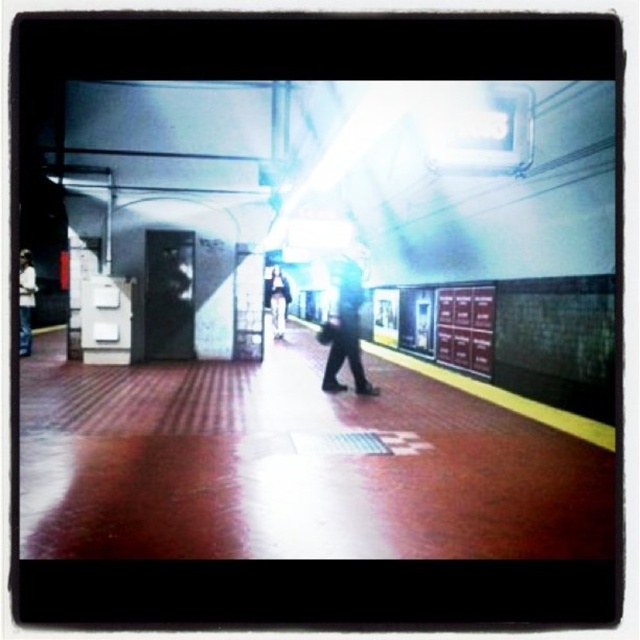
Does dark gray pants at center have a lesser width compared to light brown leather jacket at center?

Indeed, dark gray pants at center has a lesser width compared to light brown leather jacket at center.

Who is more forward, (x=348, y=308) or (x=285, y=291)?

Point (x=348, y=308) is in front.

Between point (352, 276) and point (276, 301), which one is positioned behind?

Positioned behind is point (276, 301).

In order to click on dark gray pants at center in this screenshot , I will do `click(346, 333)`.

What do you see at coordinates (320, 321) in the screenshot? Image resolution: width=640 pixels, height=640 pixels. I see `shiny metallic platform at center` at bounding box center [320, 321].

Which is behind, point (152, 227) or point (275, 330)?

Positioned behind is point (275, 330).

Image resolution: width=640 pixels, height=640 pixels. In order to click on shiny metallic platform at center in this screenshot , I will do `click(320, 321)`.

Between shiny metallic platform at center and matte black jacket at left, which one appears on the left side from the viewer's perspective?

matte black jacket at left is more to the left.

Is point (225, 186) behind point (19, 316)?

No, (225, 186) is in front of (19, 316).

Where is `shiny metallic platform at center`? shiny metallic platform at center is located at coordinates (320, 321).